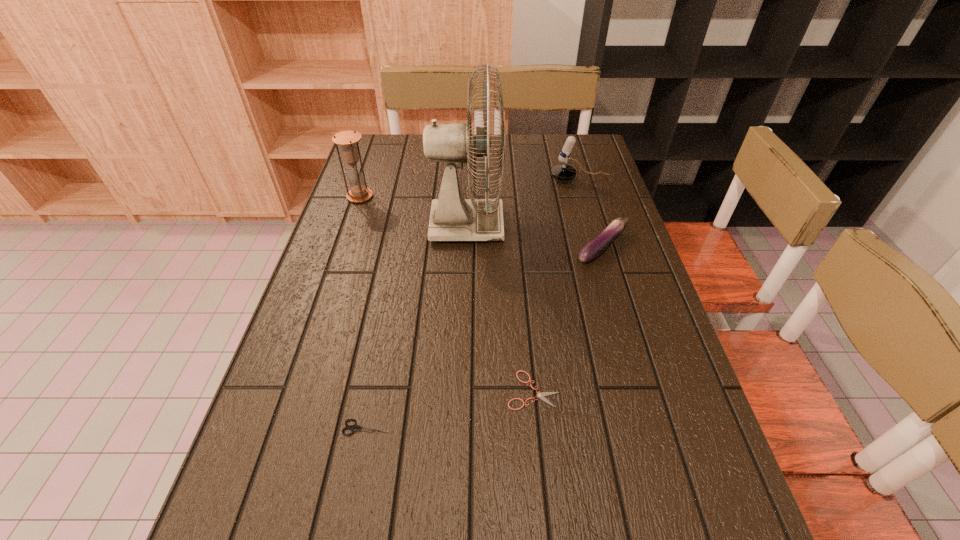
I want to click on vacant region located 0.340m on the front-facing side of the tallest object, so click(620, 226).

Where is `free space located 0.200m on the front of the leftmost object`? The height and width of the screenshot is (540, 960). free space located 0.200m on the front of the leftmost object is located at coordinates (343, 247).

Where is `free space located on the back of the microphone`? The image size is (960, 540). free space located on the back of the microphone is located at coordinates (572, 152).

Identify the location of vacant space located 0.280m on the left of the third shortest object. The height and width of the screenshot is (540, 960). (471, 247).

Image resolution: width=960 pixels, height=540 pixels. I want to click on vacant area situated on the right of the nearest object, so click(576, 427).

The image size is (960, 540). In order to click on free space located on the back of the fifth farthest object in this screenshot , I will do `click(527, 326)`.

Where is `object at the left edge`? The width and height of the screenshot is (960, 540). object at the left edge is located at coordinates (359, 192).

I want to click on microphone that is at the right edge, so click(563, 172).

Image resolution: width=960 pixels, height=540 pixels. I want to click on eggplant that is at the right edge, so click(x=595, y=247).

In the image, there is a desktop. Where is `vacant space at the far edge`? This screenshot has height=540, width=960. vacant space at the far edge is located at coordinates (430, 165).